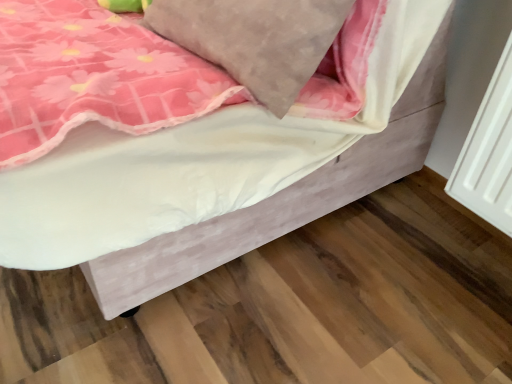
What is the approximate height of velvet pink bed at lower right?

It is 21.57 inches.

What do you see at coordinates (220, 175) in the screenshot? This screenshot has height=384, width=512. I see `velvet pink bed at lower right` at bounding box center [220, 175].

You are a GUI agent. You are given a task and a screenshot of the screen. Output one action in this format:
    pyautogui.click(x=<x>, y=<y>)
    Task: Click on the velvet pink bed at lower right
    
    Given the screenshot: What is the action you would take?
    pyautogui.click(x=220, y=175)

You are a GUI agent. You are given a task and a screenshot of the screen. Output one action in this format:
    pyautogui.click(x=<x>, y=<y>)
    Task: Click on the suede-like gray pillow at upper center
    This screenshot has height=384, width=512.
    Given the screenshot: What is the action you would take?
    pyautogui.click(x=255, y=39)

What do you see at coordinates (255, 39) in the screenshot? The height and width of the screenshot is (384, 512). I see `suede-like gray pillow at upper center` at bounding box center [255, 39].

Find the location of `velvet pink bed at lower right`. velvet pink bed at lower right is located at coordinates (220, 175).

Does velvet pink bed at lower right appear on the left side of suede-like gray pillow at upper center?

Indeed, velvet pink bed at lower right is positioned on the left side of suede-like gray pillow at upper center.

Is velvet pink bed at lower right positioned behind suede-like gray pillow at upper center?

No.

Which point is more forward, (417, 44) or (161, 9)?

The point (161, 9) is in front.

From the image's perspective, which one is positioned higher, velvet pink bed at lower right or suede-like gray pillow at upper center?

velvet pink bed at lower right.

From a real-world perspective, is velvet pink bed at lower right positioned over suede-like gray pillow at upper center based on gravity?

No, from a real-world perspective, velvet pink bed at lower right is not over suede-like gray pillow at upper center

Does velvet pink bed at lower right have a greater width compared to suede-like gray pillow at upper center?

Correct, the width of velvet pink bed at lower right exceeds that of suede-like gray pillow at upper center.

Does velvet pink bed at lower right have a greater height compared to suede-like gray pillow at upper center?

Correct, velvet pink bed at lower right is much taller as suede-like gray pillow at upper center.

Which of these two, velvet pink bed at lower right or suede-like gray pillow at upper center, is smaller?

suede-like gray pillow at upper center.

Can suede-like gray pillow at upper center be found inside velvet pink bed at lower right?

Yes, suede-like gray pillow at upper center is inside velvet pink bed at lower right.

Is velvet pink bed at lower right not near suede-like gray pillow at upper center?

That's not correct — velvet pink bed at lower right is a little close to suede-like gray pillow at upper center.

Is velvet pink bed at lower right positioned with its back to suede-like gray pillow at upper center?

Correct, velvet pink bed at lower right is looking away from suede-like gray pillow at upper center.

Looking at this image, how different are the orientations of velvet pink bed at lower right and suede-like gray pillow at upper center in degrees?

There is a 4.35-degree angle between the facing directions of velvet pink bed at lower right and suede-like gray pillow at upper center.

This screenshot has height=384, width=512. I want to click on pillow on the right of velvet pink bed at lower right, so (x=255, y=39).

Can you confirm if suede-like gray pillow at upper center is positioned to the left of velvet pink bed at lower right?

In fact, suede-like gray pillow at upper center is to the right of velvet pink bed at lower right.

Considering the positions of objects suede-like gray pillow at upper center and velvet pink bed at lower right in the image provided, who is behind, suede-like gray pillow at upper center or velvet pink bed at lower right?

suede-like gray pillow at upper center is behind.

Considering the positions of point (203, 41) and point (206, 178), is point (203, 41) closer or farther from the camera than point (206, 178)?

Clearly, point (203, 41) is more distant from the camera than point (206, 178).

From the image's perspective, is suede-like gray pillow at upper center beneath velvet pink bed at lower right?

Yes, from the image's perspective, suede-like gray pillow at upper center is below velvet pink bed at lower right.

From a real-world perspective, is suede-like gray pillow at upper center located higher than velvet pink bed at lower right?

Yes, from a real-world perspective, suede-like gray pillow at upper center is above velvet pink bed at lower right.

Between suede-like gray pillow at upper center and velvet pink bed at lower right, which one has smaller width?

suede-like gray pillow at upper center.

Considering the relative sizes of suede-like gray pillow at upper center and velvet pink bed at lower right in the image provided, is suede-like gray pillow at upper center shorter than velvet pink bed at lower right?

Yes, suede-like gray pillow at upper center is shorter than velvet pink bed at lower right.

Can you confirm if suede-like gray pillow at upper center is bigger than velvet pink bed at lower right?

No.

Is suede-like gray pillow at upper center outside of velvet pink bed at lower right?

No.

Is suede-like gray pillow at upper center far from velvet pink bed at lower right?

No, suede-like gray pillow at upper center is not far away from velvet pink bed at lower right.

Is velvet pink bed at lower right at the back of suede-like gray pillow at upper center?

Yes, velvet pink bed at lower right is at the back of suede-like gray pillow at upper center.

What's the angular difference between suede-like gray pillow at upper center and velvet pink bed at lower right's facing directions?

The angle between the facing direction of suede-like gray pillow at upper center and the facing direction of velvet pink bed at lower right is 4.35 degrees.

Locate an element on the screen. bed below the suede-like gray pillow at upper center (from a real-world perspective) is located at coordinates (220, 175).

Identify the location of bed that appears on the left of suede-like gray pillow at upper center. point(220,175).

The width and height of the screenshot is (512, 384). Identify the location of pillow behind the velvet pink bed at lower right. (255, 39).